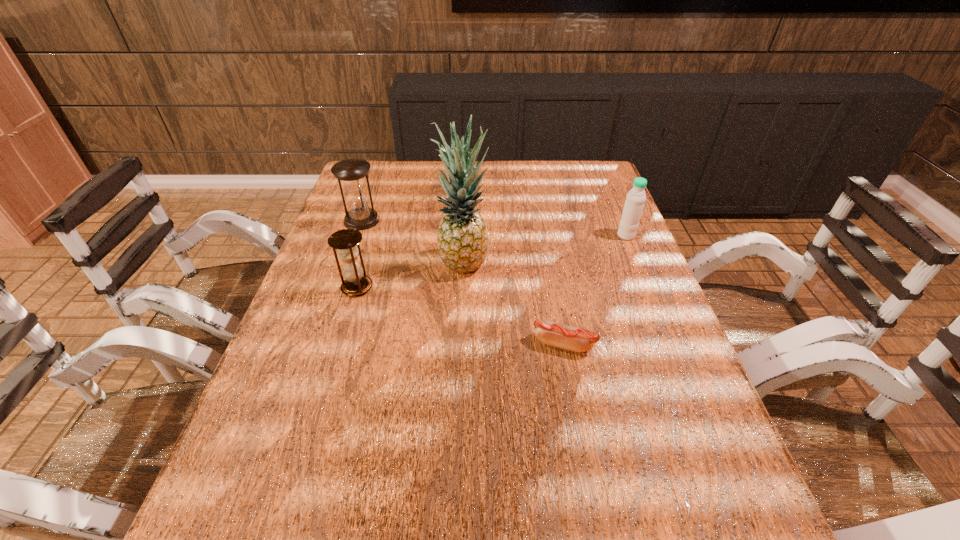
Locate an element on the screen. The width and height of the screenshot is (960, 540). free location located on the right of the nearer hourglass is located at coordinates (493, 287).

At what (x,y) coordinates should I click in order to perform the action: click on vacant area situated 0.220m on the back of the nearest object. Please return your answer as a coordinate pair (x, y). Looking at the image, I should click on (550, 269).

I want to click on object at the right edge, so click(634, 204).

Where is `free location at the far edge of the desktop`? This screenshot has height=540, width=960. free location at the far edge of the desktop is located at coordinates (536, 160).

At what (x,y) coordinates should I click in order to perform the action: click on vacant space at the left edge of the desktop. Please return your answer as a coordinate pair (x, y). Image resolution: width=960 pixels, height=540 pixels. Looking at the image, I should click on (393, 196).

At what (x,y) coordinates should I click in order to perform the action: click on vacant space at the right edge. Please return your answer as a coordinate pair (x, y). The height and width of the screenshot is (540, 960). Looking at the image, I should click on (x=605, y=230).

The image size is (960, 540). In order to click on free space at the far right corner of the desktop in this screenshot , I will do pos(587,164).

This screenshot has width=960, height=540. In the image, there is a desktop. In order to click on blank space at the near right corner in this screenshot , I will do `click(662, 530)`.

Find the location of a particular element. The width and height of the screenshot is (960, 540). empty space between the farther hourglass and the fourth object from left to right is located at coordinates (463, 282).

Locate an element on the screen. This screenshot has height=540, width=960. free spot between the pineapple and the farther hourglass is located at coordinates (413, 241).